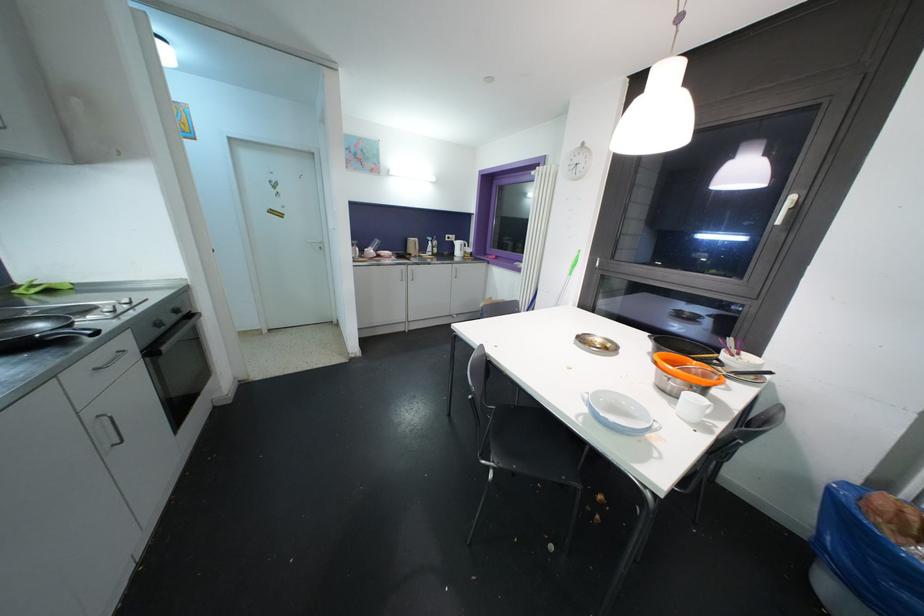
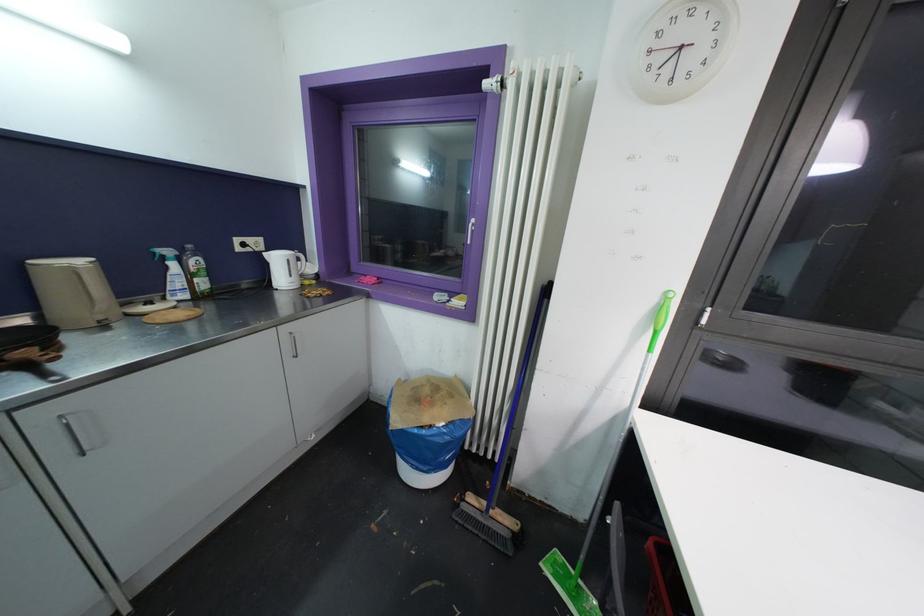
Find the pixel in the second image that matches pixel 500 260 in the first image.

(383, 284)